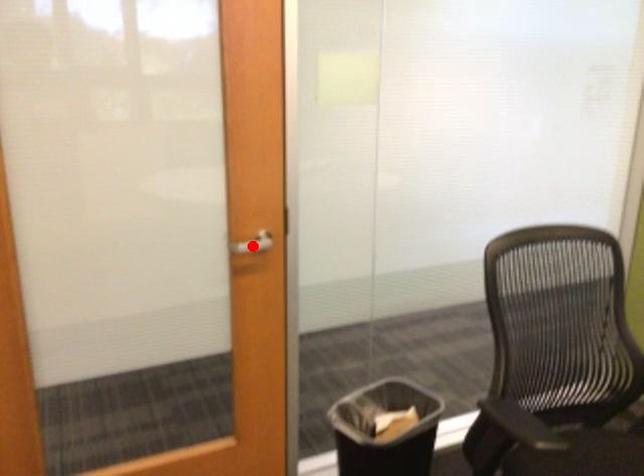
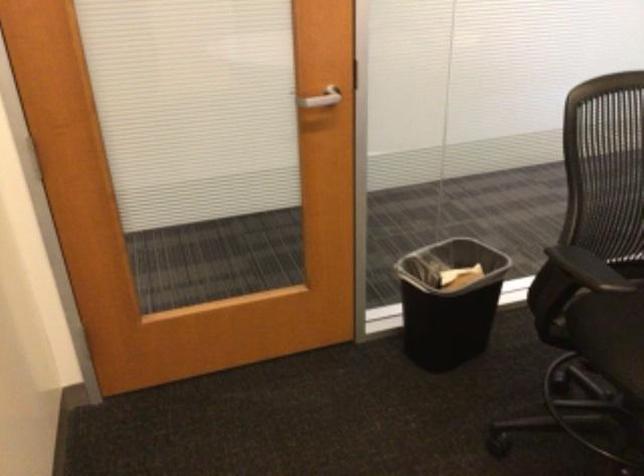
Locate, in the second image, the point that corresponds to the highlighted location in the first image.

(321, 98)